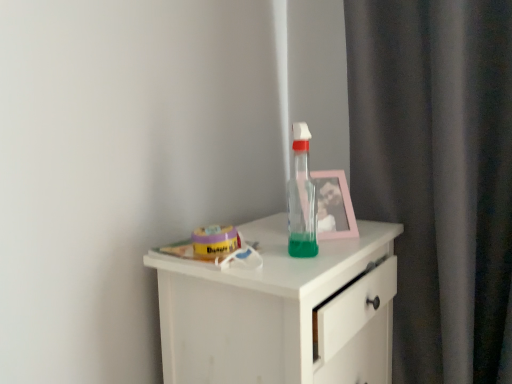
Question: Is pink plastic picture frame at upper right taller or shorter than transparent plastic bottle at center?

Choices:
 (A) short
 (B) tall

Answer: (A)

Question: Is pink plastic picture frame at upper right inside the boundaries of transparent plastic bottle at center, or outside?

Choices:
 (A) outside
 (B) inside

Answer: (A)

Question: Based on their relative distances, which object is nearer to the white matte chest of drawers at center?

Choices:
 (A) pink plastic picture frame at upper right
 (B) transparent plastic bottle at center

Answer: (B)

Question: Based on their relative distances, which object is nearer to the transparent plastic bottle at center?

Choices:
 (A) pink plastic picture frame at upper right
 (B) white matte chest of drawers at center

Answer: (A)